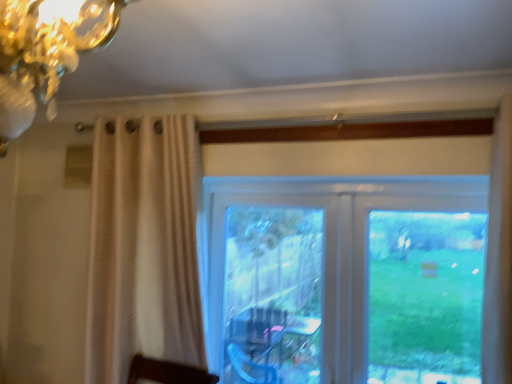
Question: Is transparent glass screen door at center next to transparent glass window at center and touching it?

Choices:
 (A) yes
 (B) no

Answer: (B)

Question: Does transparent glass screen door at center turn towards transparent glass window at center?

Choices:
 (A) yes
 (B) no

Answer: (A)

Question: Does transparent glass screen door at center have a greater height compared to transparent glass window at center?

Choices:
 (A) yes
 (B) no

Answer: (B)

Question: Is transparent glass screen door at center positioned with its back to transparent glass window at center?

Choices:
 (A) no
 (B) yes

Answer: (B)

Question: Does transparent glass screen door at center have a lesser height compared to transparent glass window at center?

Choices:
 (A) no
 (B) yes

Answer: (B)

Question: Is transparent glass screen door at center outside of transparent glass window at center?

Choices:
 (A) no
 (B) yes

Answer: (A)

Question: Considering the relative sizes of transparent glass window at center and transparent glass screen door at center in the image provided, is transparent glass window at center thinner than transparent glass screen door at center?

Choices:
 (A) yes
 (B) no

Answer: (B)

Question: Considering the relative sizes of transparent glass window at center and transparent glass screen door at center in the image provided, is transparent glass window at center wider than transparent glass screen door at center?

Choices:
 (A) yes
 (B) no

Answer: (A)

Question: Is transparent glass window at center positioned with its back to transparent glass screen door at center?

Choices:
 (A) yes
 (B) no

Answer: (A)

Question: Is transparent glass screen door at center completely or partially inside transparent glass window at center?

Choices:
 (A) no
 (B) yes

Answer: (B)

Question: Is transparent glass window at center outside of transparent glass screen door at center?

Choices:
 (A) yes
 (B) no

Answer: (B)

Question: From the image's perspective, is transparent glass window at center above transparent glass screen door at center?

Choices:
 (A) yes
 (B) no

Answer: (A)

Question: Is transparent glass window at center situated inside transparent glass screen door at center or outside?

Choices:
 (A) outside
 (B) inside

Answer: (B)